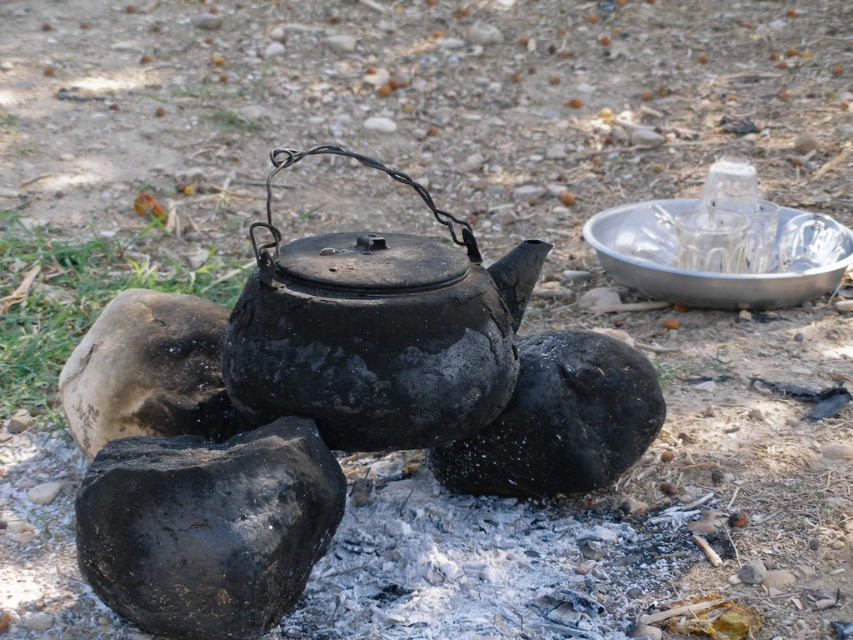
Who is lower down, charcoal black rock at lower left or brown rough rock at left?

charcoal black rock at lower left is lower down.

Between charcoal black rock at lower left and brown rough rock at left, which one appears on the left side from the viewer's perspective?

From the viewer's perspective, brown rough rock at left appears more on the left side.

Identify the location of charcoal black rock at lower left. (207, 525).

Locate an element on the screen. charcoal black rock at lower left is located at coordinates [x=207, y=525].

Does point (352, 333) come farther from viewer compared to point (468, 451)?

No, it is in front of (468, 451).

I want to click on black matte teapot at center, so click(x=376, y=330).

What do you see at coordinates (560, 420) in the screenshot? I see `charcoal black rock at center` at bounding box center [560, 420].

Is point (592, 348) positioned after point (125, 376)?

Yes, point (592, 348) is farther from viewer.

I want to click on charcoal black rock at center, so tap(560, 420).